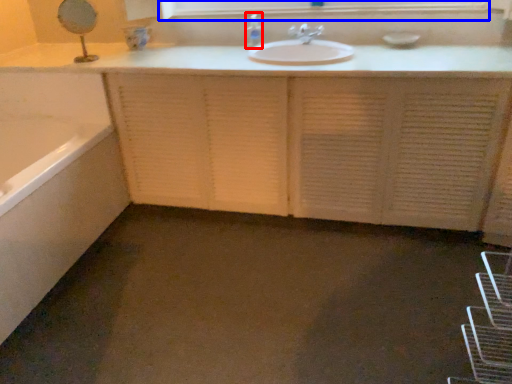
Question: Which point is further to the camera, soap dispenser (highlighted by a red box) or medicine cabinet (highlighted by a blue box)?

Choices:
 (A) soap dispenser
 (B) medicine cabinet

Answer: (A)